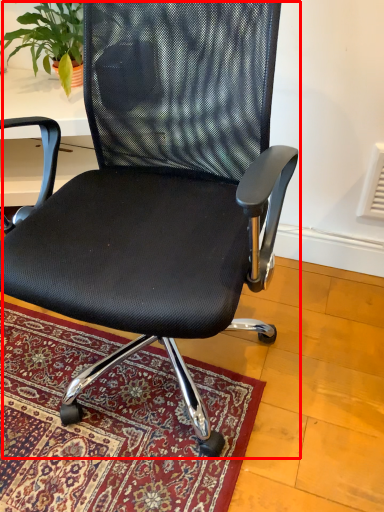
Question: From the image's perspective, where is chair (annotated by the red box) located in relation to houseplant in the image?

Choices:
 (A) above
 (B) below

Answer: (B)